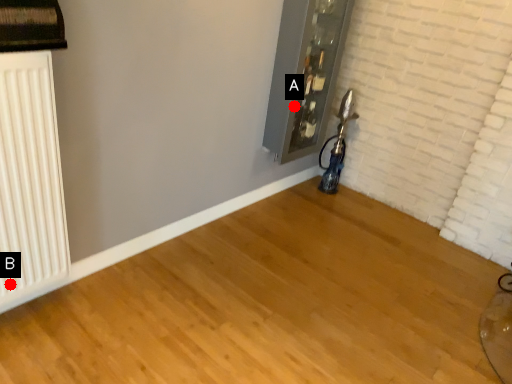
Question: Two points are circled on the image, labeled by A and B beside each circle. Among these points, which one is farthest from the camera?

Choices:
 (A) A is further
 (B) B is further

Answer: (A)